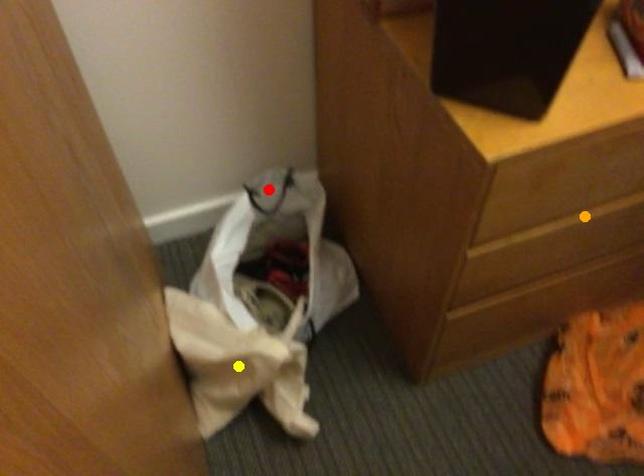
Order these from farthest to nearest:
yellow point | red point | orange point

red point, yellow point, orange point